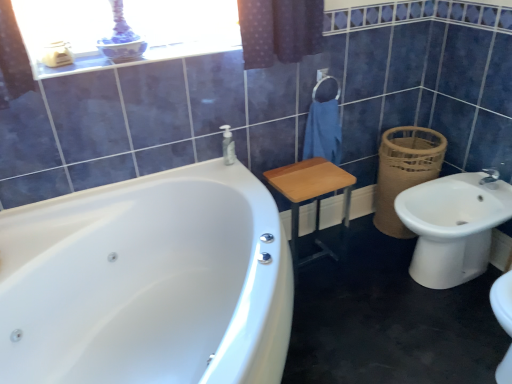
Locate an element on the screen. This screenshot has width=512, height=384. vacant area that lies between white glossy sink at lower right and brown woven basket at right is located at coordinates (380, 244).